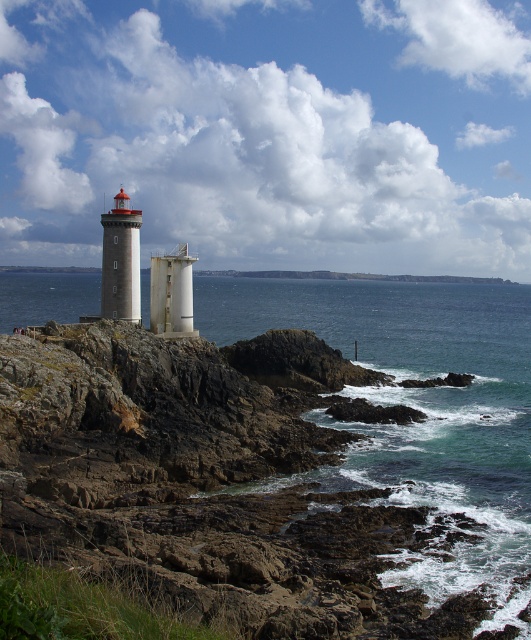
Is blue-green water at center positioned at the back of white matte tower at center?

No, it is not.

Describe the element at coordinates (415, 422) in the screenshot. I see `blue-green water at center` at that location.

Is point (364, 346) positioned in front of point (183, 294)?

No, it is not.

Image resolution: width=531 pixels, height=640 pixels. What are the coordinates of `blue-green water at center` in the screenshot? It's located at (415, 422).

Is white painted metal lighthouse at left smaller than white matte tower at center?

Yes.

Is the position of white painted metal lighthouse at left less distant than that of white matte tower at center?

Yes, it is in front of white matte tower at center.

This screenshot has height=640, width=531. I want to click on white painted metal lighthouse at left, so click(121, 260).

Does blue-green water at center appear on the right side of white painted metal lighthouse at left?

Correct, you'll find blue-green water at center to the right of white painted metal lighthouse at left.

Does blue-green water at center have a greater width compared to white painted metal lighthouse at left?

Correct, the width of blue-green water at center exceeds that of white painted metal lighthouse at left.

Is point (381, 481) positioned before point (123, 289)?

Yes, it is in front of point (123, 289).

This screenshot has width=531, height=640. Identify the location of blue-green water at center. (415, 422).